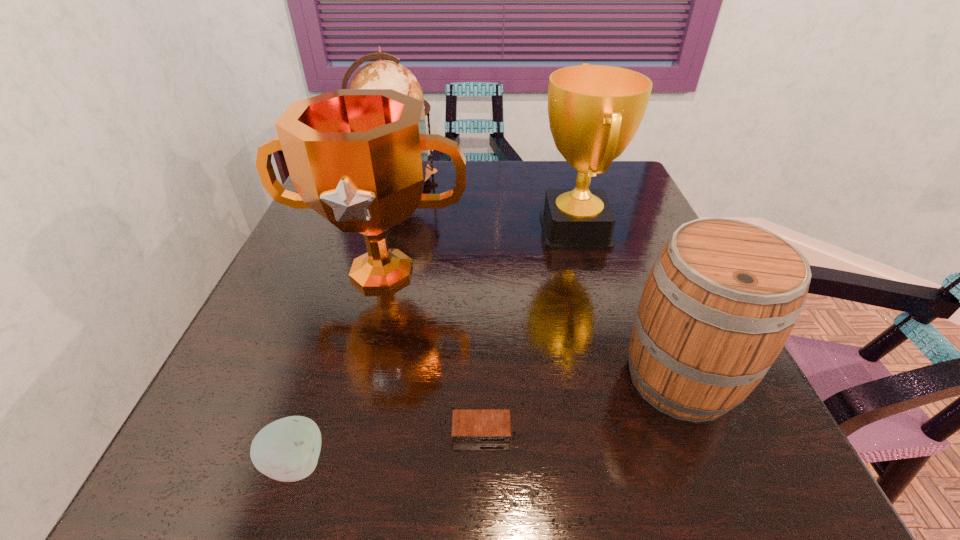
Where is `object that stands as the fourth closest to the right award`? This screenshot has height=540, width=960. object that stands as the fourth closest to the right award is located at coordinates (469, 426).

Identify which object is located as the fourth nearest to the apple. Please provide its 2D coordinates. Your answer should be formatted as a tuple, i.e. [(x, y)], where the tuple contains the x and y coordinates of a point satisfying the conditions above.

[(594, 111)]

This screenshot has width=960, height=540. I want to click on vacant region that satisfies the following two spatial constraints: 1. on the front-facing side of the right award; 2. on the side of the left award with the star emblem, so click(x=588, y=273).

The width and height of the screenshot is (960, 540). In order to click on free location that satisfies the following two spatial constraints: 1. on the front-facing side of the right award; 2. on the front face of the alarm clock in this screenshot , I will do `click(632, 430)`.

Find the location of `vacant space that satisfies the following two spatial constraints: 1. at the center of the globe; 2. on the back side of the cider`. vacant space that satisfies the following two spatial constraints: 1. at the center of the globe; 2. on the back side of the cider is located at coordinates (342, 378).

Where is `free space that satisfies the following two spatial constraints: 1. on the front-facing side of the right award; 2. on the front face of the alarm clock`? This screenshot has height=540, width=960. free space that satisfies the following two spatial constraints: 1. on the front-facing side of the right award; 2. on the front face of the alarm clock is located at coordinates tap(632, 430).

The height and width of the screenshot is (540, 960). I want to click on blank area in the image that satisfies the following two spatial constraints: 1. on the front-facing side of the right award; 2. on the side of the left award with the star emblem, so 588,273.

Where is `free location that satisfies the following two spatial constraints: 1. on the front-facing side of the right award; 2. on the front face of the shortest object`? This screenshot has width=960, height=540. free location that satisfies the following two spatial constraints: 1. on the front-facing side of the right award; 2. on the front face of the shortest object is located at coordinates (632, 430).